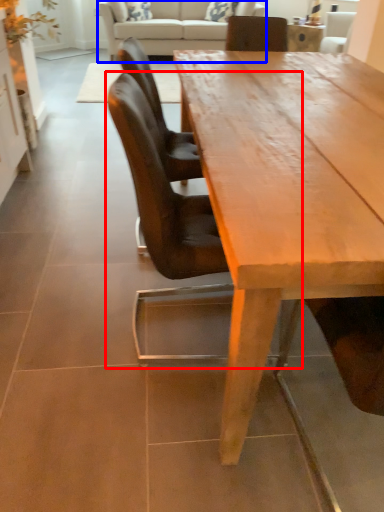
Question: Which point is closer to the camera, chair (highlighted by a red box) or studio couch (highlighted by a blue box)?

Choices:
 (A) chair
 (B) studio couch

Answer: (A)